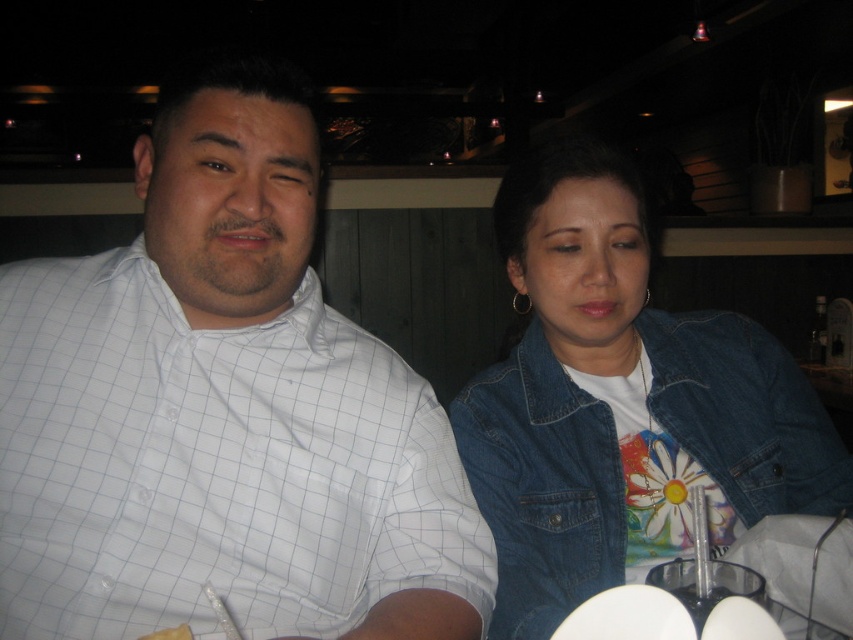
Measure the distance from white checkered shirt at left to faded denim jacket at lower right.

white checkered shirt at left and faded denim jacket at lower right are 11.82 inches apart from each other.

Can you confirm if white checkered shirt at left is taller than faded denim jacket at lower right?

Indeed, white checkered shirt at left has a greater height compared to faded denim jacket at lower right.

You are a GUI agent. You are given a task and a screenshot of the screen. Output one action in this format:
    pyautogui.click(x=<x>, y=<y>)
    Task: Click on the white checkered shirt at left
    
    Given the screenshot: What is the action you would take?
    pyautogui.click(x=222, y=410)